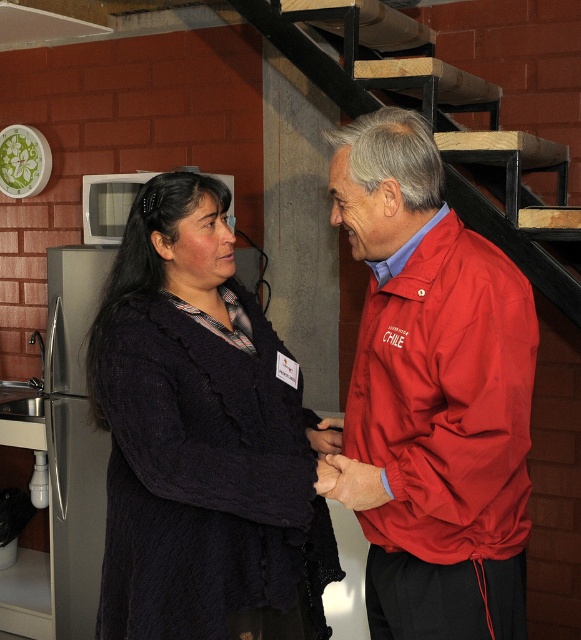
Which of these two, red nylon jacket at center or wooden stairs at upper center, stands taller?

red nylon jacket at center

Can you confirm if red nylon jacket at center is positioned below wooden stairs at upper center?

Yes.

Between point (399, 182) and point (349, 90), which one is positioned in front?

Point (399, 182) is more forward.

Locate an element on the screen. The image size is (581, 640). red nylon jacket at center is located at coordinates (432, 394).

Is dark blue knitted sweater at center to the left of wooden stairs at upper center from the viewer's perspective?

Yes, dark blue knitted sweater at center is to the left of wooden stairs at upper center.

Does dark blue knitted sweater at center have a larger size compared to wooden stairs at upper center?

Yes, dark blue knitted sweater at center is bigger than wooden stairs at upper center.

Does point (203, 577) come farther from viewer compared to point (352, 115)?

No, (203, 577) is in front of (352, 115).

Image resolution: width=581 pixels, height=640 pixels. Identify the location of dark blue knitted sweater at center. (200, 436).

Is dark blue knitted sweater at center shorter than red nylon jacket at center?

Yes.

Between point (221, 204) and point (428, 524), which one is positioned in front?

Point (428, 524) is in front.

You are a GUI agent. You are given a task and a screenshot of the screen. Output one action in this format:
    pyautogui.click(x=<x>, y=<y>)
    Task: Click on the dark blue knitted sweater at center
    The height and width of the screenshot is (640, 581).
    Given the screenshot: What is the action you would take?
    pyautogui.click(x=200, y=436)

You are a GUI agent. You are given a task and a screenshot of the screen. Output one action in this format:
    pyautogui.click(x=<x>, y=<y>)
    Task: Click on the dark blue knitted sweater at center
    Image resolution: width=581 pixels, height=640 pixels.
    Given the screenshot: What is the action you would take?
    pyautogui.click(x=200, y=436)